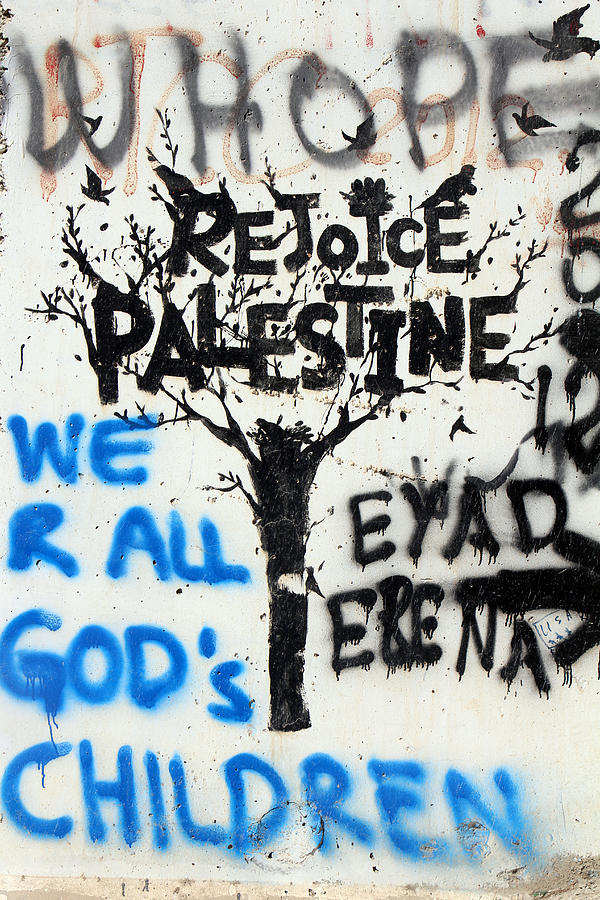
Identify the location of black words spray painted on the wall. The image size is (600, 900). (403, 249), (326, 392), (418, 554), (423, 635), (585, 328), (363, 114).